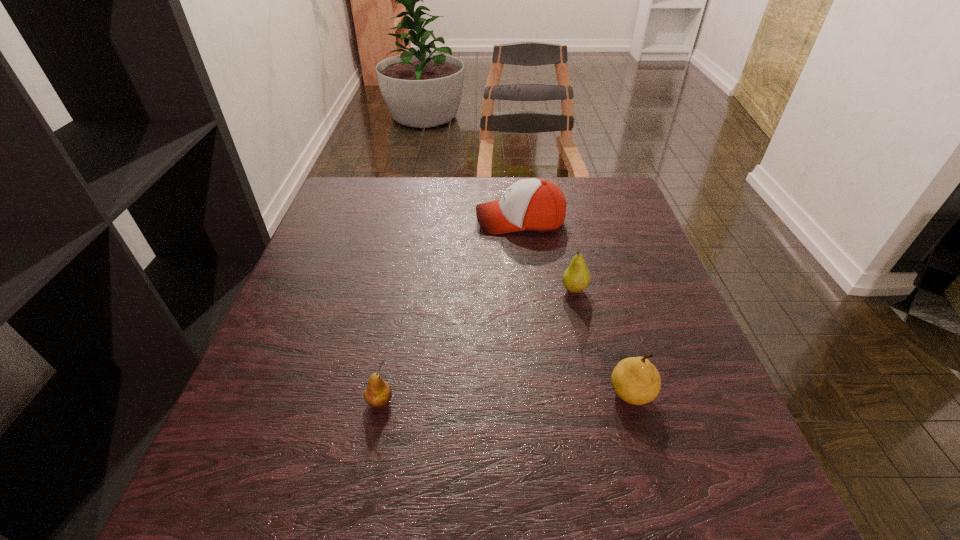
This screenshot has width=960, height=540. Identify the location of free space between the farthest object and the shortest pear. (450, 311).

The width and height of the screenshot is (960, 540). I want to click on object that is the closest one to the farthest pear, so [538, 205].

Identify which object is the third nearest to the farthest pear. Please provide its 2D coordinates. Your answer should be formatted as a tuple, i.e. [(x, y)], where the tuple contains the x and y coordinates of a point satisfying the conditions above.

[(378, 393)]

Choose which pear is the third nearest neighbor to the baseball cap. Please provide its 2D coordinates. Your answer should be formatted as a tuple, i.e. [(x, y)], where the tuple contains the x and y coordinates of a point satisfying the conditions above.

[(378, 393)]

Identify the location of pear identified as the second closest to the farthest pear. (378, 393).

Identify the location of vacant point that satisfies the following two spatial constraints: 1. on the back side of the farthest pear; 2. on the front-facing side of the farthest object. (559, 221).

This screenshot has width=960, height=540. What are the coordinates of `vacant space that satisfies the following two spatial constraints: 1. on the back side of the second farthest object; 2. on the front-facing side of the baseball cap` in the screenshot? It's located at (559, 221).

What are the coordinates of `blank space that satisfies the following two spatial constraints: 1. on the back side of the farthest pear; 2. on the front-facing side of the baseball cap` in the screenshot? It's located at (559, 221).

Locate an element on the screen. free space that satisfies the following two spatial constraints: 1. on the front-facing side of the baseball cap; 2. on the back side of the third nearest object is located at coordinates coord(528,290).